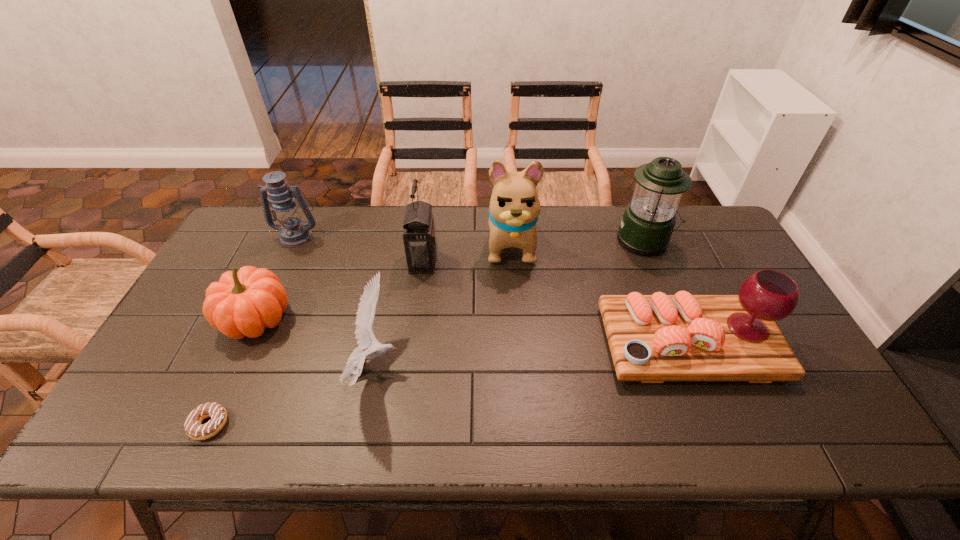
Locate an element on the screen. The image size is (960, 540). pumpkin positioned at the left edge is located at coordinates (243, 303).

Locate an element on the screen. This screenshot has width=960, height=540. object at the right edge is located at coordinates (654, 338).

The width and height of the screenshot is (960, 540). Identify the location of object at the far left corner. (293, 232).

The height and width of the screenshot is (540, 960). In order to click on vacant space at the far edge in this screenshot , I will do `click(404, 250)`.

Where is `free space at the near edge`? The height and width of the screenshot is (540, 960). free space at the near edge is located at coordinates (353, 414).

In the image, there is a desktop. What are the coordinates of `vacant space at the left edge` in the screenshot? It's located at click(137, 392).

This screenshot has width=960, height=540. I want to click on vacant space at the far right corner of the desktop, so click(703, 236).

In order to click on vacant region between the puppy and the second lantern from left to right in this screenshot , I will do `click(467, 252)`.

This screenshot has height=540, width=960. In order to click on empty space that is in between the leftmost lantern and the platter in this screenshot , I will do `click(492, 290)`.

The image size is (960, 540). What are the coordinates of `blank region between the platter and the pumpkin` in the screenshot? It's located at (472, 331).